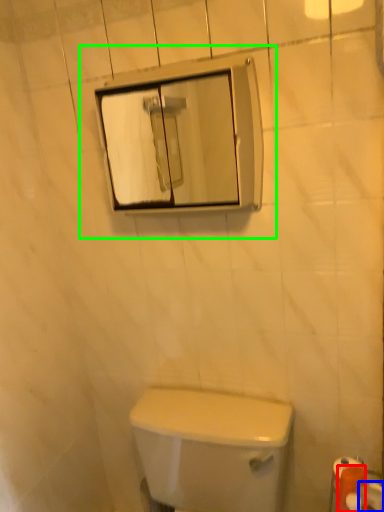
Question: Based on their relative distances, which object is nearer to toilet paper (highlighted by a red box)? Choose from toilet paper (highlighted by a blue box) and view mirror (highlighted by a green box).

Choices:
 (A) toilet paper
 (B) view mirror

Answer: (A)